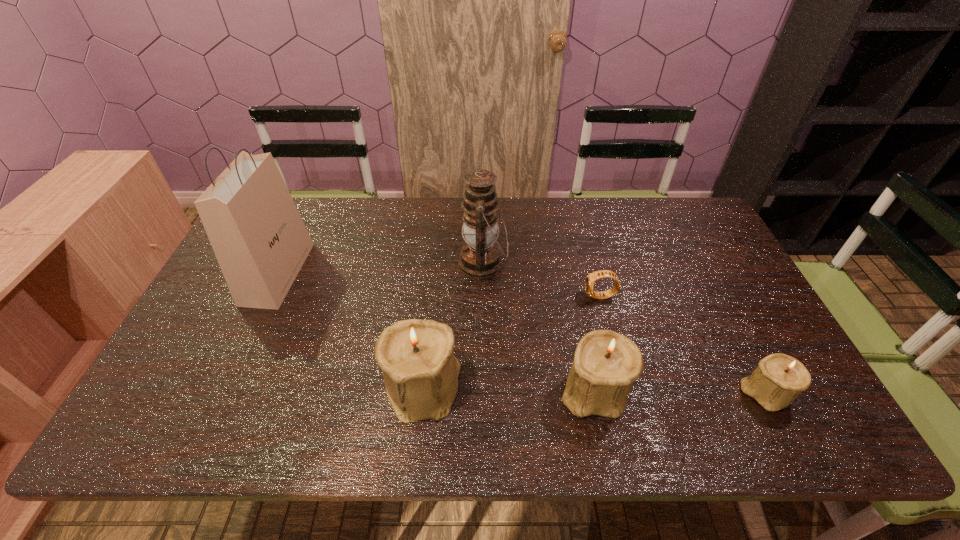
At what (x,y) coordinates should I click in order to perform the action: click on free space that satisfies the following two spatial constraints: 1. on the face of the rightmost object; 2. on the right side of the watch. Please return your answer as a coordinate pair (x, y). Image resolution: width=960 pixels, height=540 pixels. Looking at the image, I should click on (625, 393).

You are a GUI agent. You are given a task and a screenshot of the screen. Output one action in this format:
    pyautogui.click(x=<x>, y=<y>)
    Task: Click on the free space that satisfies the following two spatial constraints: 1. on the back side of the rightmost candle_holder; 2. on the face of the watch
    Image resolution: width=960 pixels, height=540 pixels.
    Given the screenshot: What is the action you would take?
    pyautogui.click(x=717, y=297)